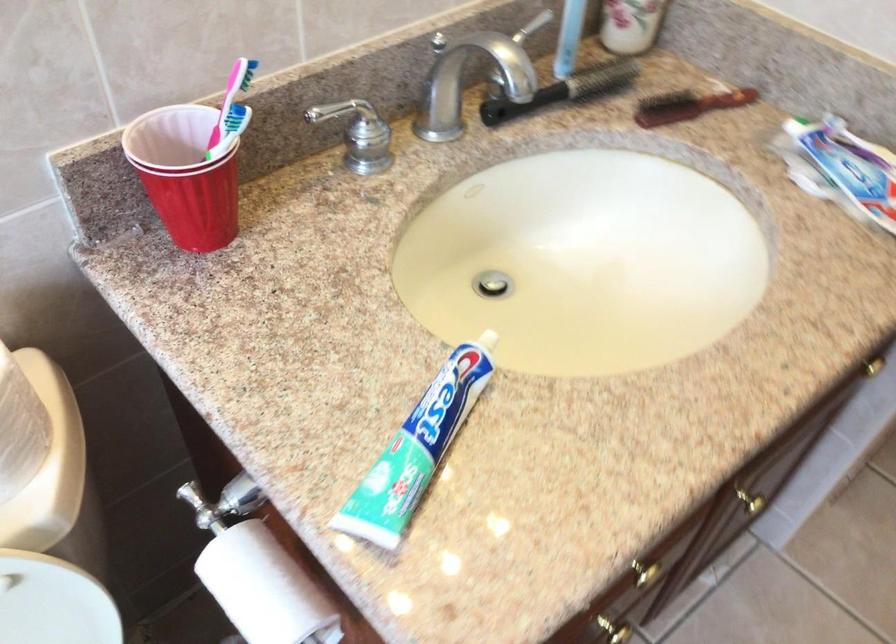
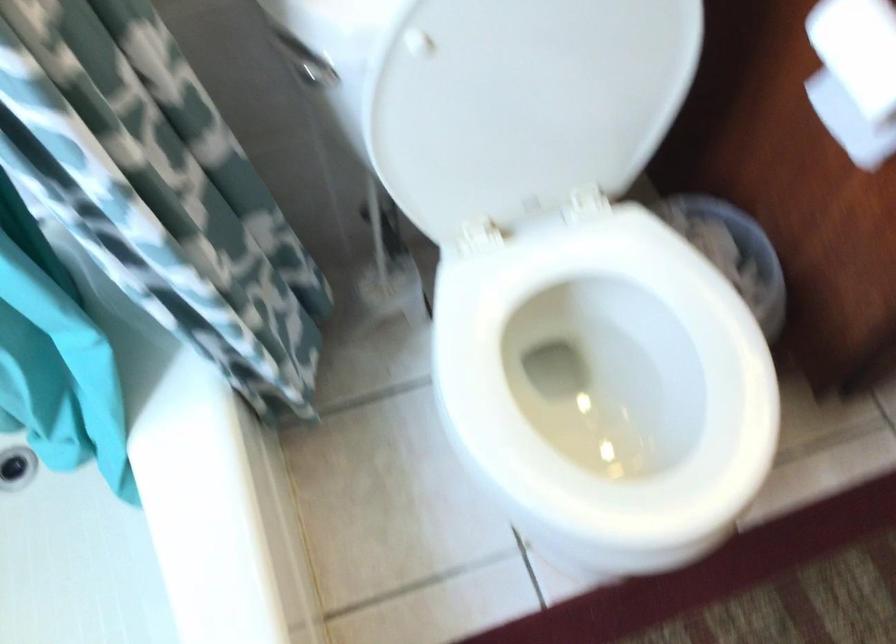
The images are taken continuously from a first-person perspective. In which direction are you moving?

The cameraman moved toward left, backward.